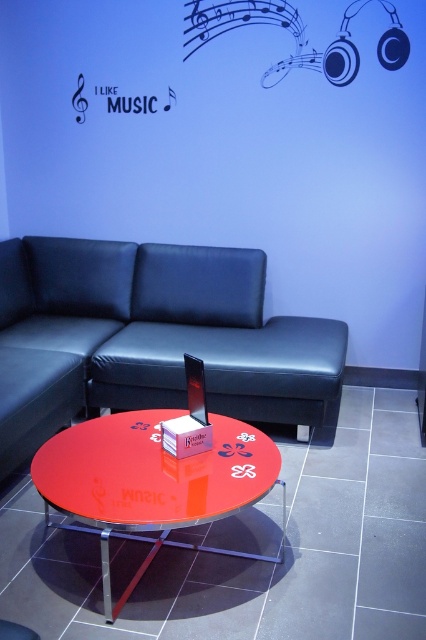
This screenshot has height=640, width=426. I want to click on black leather couch at center, so click(169, 326).

Does black leather couch at center have a greater height compared to glossy red table at center?

Yes.

Between point (129, 352) and point (267, 474), which one is positioned in front?

Positioned in front is point (267, 474).

I want to click on black leather couch at center, so click(x=169, y=326).